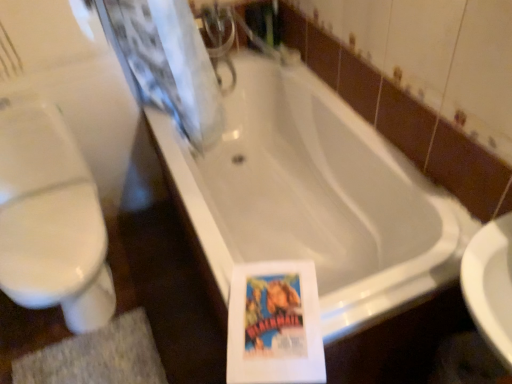
Question: From a real-world perspective, is gray textured bath mat at lower left under white glossy toilet at left?

Choices:
 (A) yes
 (B) no

Answer: (A)

Question: Are gray textured bath mat at lower left and white glossy toilet at left beside each other?

Choices:
 (A) no
 (B) yes

Answer: (A)

Question: Can you confirm if gray textured bath mat at lower left is smaller than white glossy toilet at left?

Choices:
 (A) yes
 (B) no

Answer: (A)

Question: Can white glossy toilet at left be found inside gray textured bath mat at lower left?

Choices:
 (A) no
 (B) yes

Answer: (A)

Question: Does gray textured bath mat at lower left have a larger size compared to white glossy toilet at left?

Choices:
 (A) yes
 (B) no

Answer: (B)

Question: Does gray textured bath mat at lower left lie in front of white glossy toilet at left?

Choices:
 (A) yes
 (B) no

Answer: (B)

Question: Does white glossy bathtub at center have a lesser width compared to gray textured bath mat at lower left?

Choices:
 (A) no
 (B) yes

Answer: (A)

Question: Is white glossy bathtub at center beside gray textured bath mat at lower left?

Choices:
 (A) no
 (B) yes

Answer: (A)

Question: Does white glossy bathtub at center have a greater width compared to gray textured bath mat at lower left?

Choices:
 (A) no
 (B) yes

Answer: (B)

Question: From a real-world perspective, is white glossy bathtub at center on gray textured bath mat at lower left?

Choices:
 (A) yes
 (B) no

Answer: (A)

Question: From the image's perspective, does white glossy bathtub at center appear higher than gray textured bath mat at lower left?

Choices:
 (A) yes
 (B) no

Answer: (A)

Question: Considering the relative positions of white glossy bathtub at center and gray textured bath mat at lower left in the image provided, is white glossy bathtub at center to the left of gray textured bath mat at lower left from the viewer's perspective?

Choices:
 (A) yes
 (B) no

Answer: (B)

Question: From a real-world perspective, is white glossy toilet at left physically below gray textured bath mat at lower left?

Choices:
 (A) yes
 (B) no

Answer: (B)